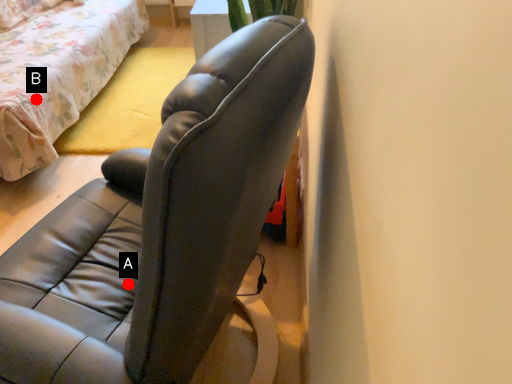
Question: Two points are circled on the image, labeled by A and B beside each circle. Which point appears farthest from the camera in this image?

Choices:
 (A) A is further
 (B) B is further

Answer: (B)